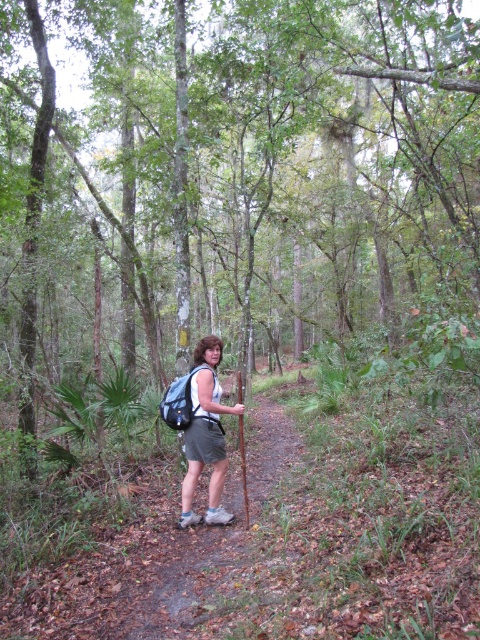
Question: Is gray fabric backpack at center to the right of matte gray backpack at center from the viewer's perspective?

Choices:
 (A) no
 (B) yes

Answer: (B)

Question: Among these points, which one is farthest from the camera?

Choices:
 (A) pos(220,460)
 (B) pos(182,410)

Answer: (A)

Question: Is gray fabric backpack at center to the right of matte gray backpack at center from the viewer's perspective?

Choices:
 (A) no
 (B) yes

Answer: (B)

Question: Which point is closer to the camera?

Choices:
 (A) (200, 634)
 (B) (216, 410)

Answer: (A)

Question: Which of these objects is positioned farthest from the matte gray shorts at center?

Choices:
 (A) matte gray backpack at center
 (B) gray fabric backpack at center

Answer: (B)

Question: Is gray fabric backpack at center bigger than matte gray backpack at center?

Choices:
 (A) no
 (B) yes

Answer: (B)